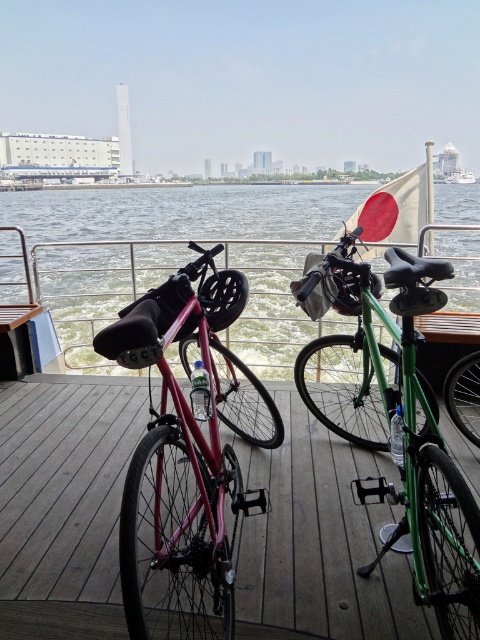
Does point (308, 611) come behind point (310, 310)?

No.

Can you confirm if matte black bicycle at center is wider than green matte bicycle at center?

Correct, the width of matte black bicycle at center exceeds that of green matte bicycle at center.

Find the location of `matte black bicycle at center`. matte black bicycle at center is located at coordinates (66, 499).

Where is `matte black bicycle at center`? This screenshot has width=480, height=640. matte black bicycle at center is located at coordinates (66, 499).

Which is more to the left, matte pink bike at left or green glossy water at center?

matte pink bike at left is more to the left.

Is matte pink bike at left closer to camera compared to green glossy water at center?

Yes, it is in front of green glossy water at center.

Which is in front, point (133, 344) or point (304, 339)?

Positioned in front is point (133, 344).

Where is `matte pink bike at left`? Image resolution: width=480 pixels, height=640 pixels. matte pink bike at left is located at coordinates (183, 460).

Is point (309, 564) less distant than point (251, 214)?

Yes, point (309, 564) is closer to viewer.

The width and height of the screenshot is (480, 640). I want to click on matte black bicycle at center, so click(x=66, y=499).

This screenshot has height=640, width=480. I want to click on matte black bicycle at center, so click(66, 499).